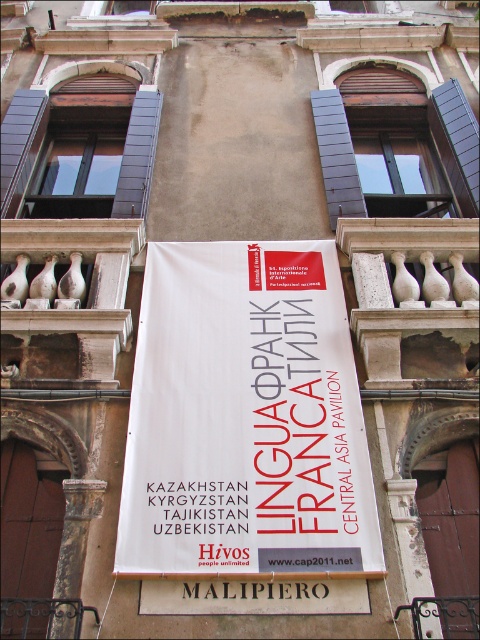
You are standing in front of the building and want to read the text on the white paper banner at center. Where should you look to find it?

You should look at point [245,417] to find the white paper banner at center.

You are standing in front of the building and notice a dark gray wood shutter at upper center. Where exactly is it located in terms of coordinates?

The dark gray wood shutter at upper center is located at point (336, 156).

You are standing in front of the building and notice two wooden features. The dark gray wood shutter at upper center and the dark brown wood at left. Which one is positioned to the right of the other?

The dark gray wood shutter at upper center is positioned to the right of the dark brown wood at left.